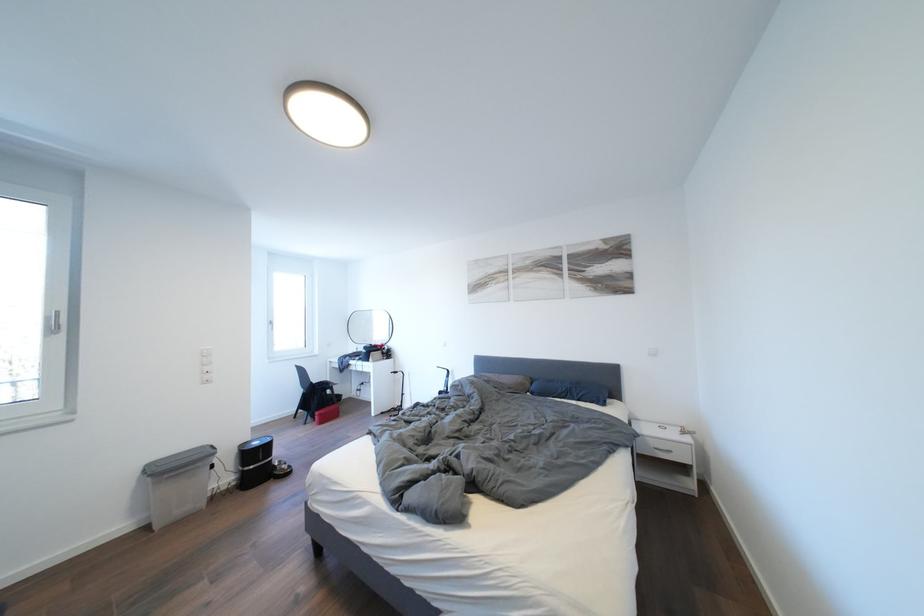
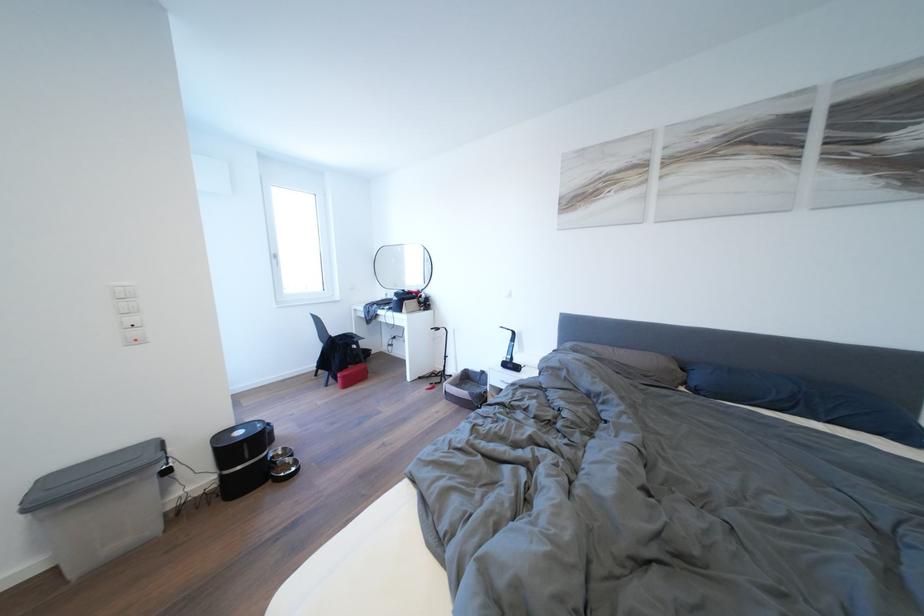
Where in the second image is the point corresponding to point 493,383 from the first image?

(602, 360)